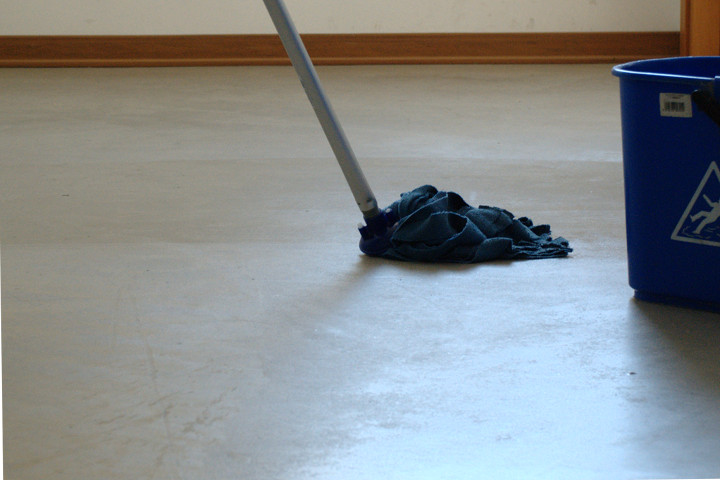
You are a GUI agent. You are given a task and a screenshot of the screen. Output one action in this format:
    pyautogui.click(x=<x>, y=<y>)
    Task: Click on the glare from light source
    
    Given the screenshot: What is the action you would take?
    pyautogui.click(x=471, y=412)